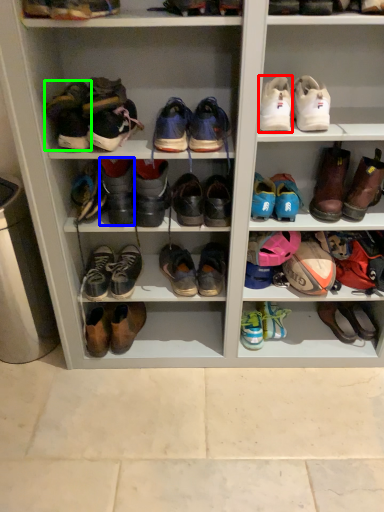
Question: Estimate the real-world distances between objects in this image. Which object is closer to shoe (highlighted by a red box), footwear (highlighted by a blue box) or shoe (highlighted by a green box)?

Choices:
 (A) footwear
 (B) shoe

Answer: (A)